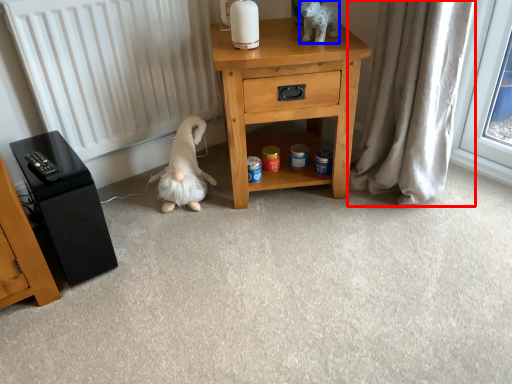
Question: Which object appears farthest to the camera in this image, curtain (highlighted by a red box) or animal (highlighted by a blue box)?

Choices:
 (A) curtain
 (B) animal

Answer: (B)